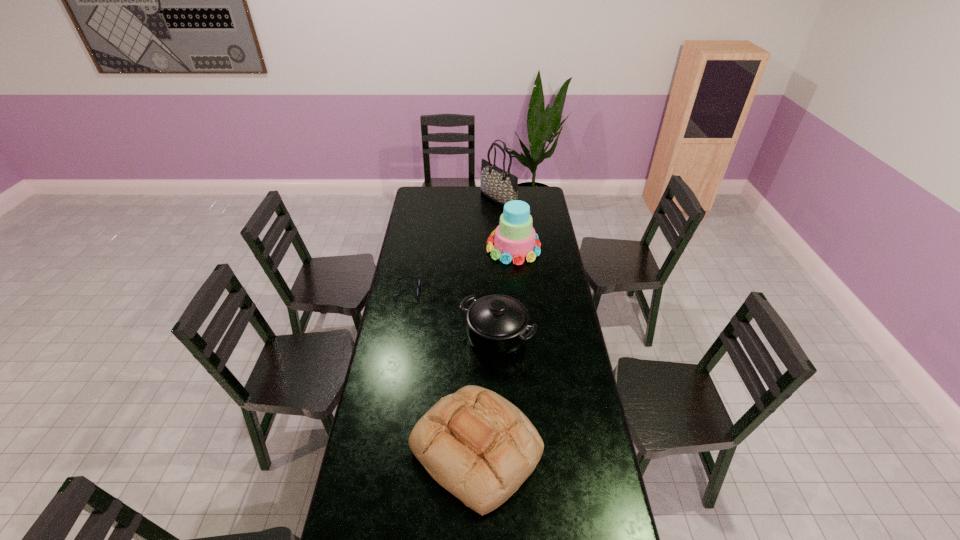
Where is `blank area located on the back of the saucepan`? This screenshot has width=960, height=540. blank area located on the back of the saucepan is located at coordinates (495, 293).

At what (x,y) coordinates should I click in order to perform the action: click on free space located on the right of the nearest object. Please return your answer as a coordinate pair (x, y). This screenshot has width=960, height=540. Looking at the image, I should click on 601,450.

The image size is (960, 540). I want to click on vacant space located on the front-facing side of the shortest object, so click(502, 291).

I want to click on object that is at the far edge, so click(x=500, y=186).

Where is `object that is at the left edge`? The image size is (960, 540). object that is at the left edge is located at coordinates (418, 285).

Locate an element on the screen. object at the right edge is located at coordinates (514, 239).

Find the location of `vacant space at the left edge of the desktop`. vacant space at the left edge of the desktop is located at coordinates (396, 275).

Image resolution: width=960 pixels, height=540 pixels. Find the location of `free space at the right edge of the desktop`. free space at the right edge of the desktop is located at coordinates (577, 521).

I want to click on blank space at the far right corner, so click(539, 192).

Find the location of a particular element. The width and height of the screenshot is (960, 540). free point between the spectacles and the fourth farthest object is located at coordinates (452, 314).